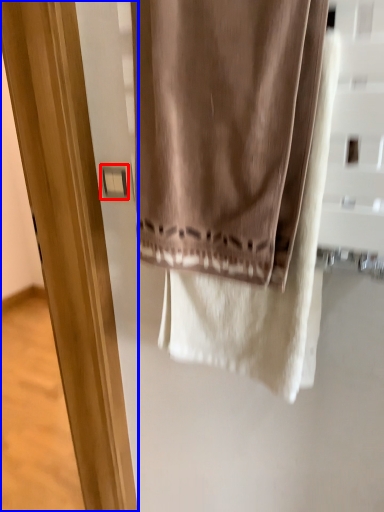
Question: Which of the following is the closest to the observer, light switch (highlighted by a red box) or screen door (highlighted by a blue box)?

Choices:
 (A) light switch
 (B) screen door

Answer: (B)